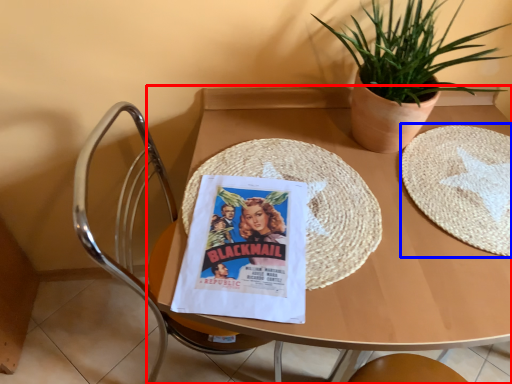
Question: Which of the following is the farthest to the observer, table (highlighted by a red box) or paper plate (highlighted by a blue box)?

Choices:
 (A) table
 (B) paper plate

Answer: (B)